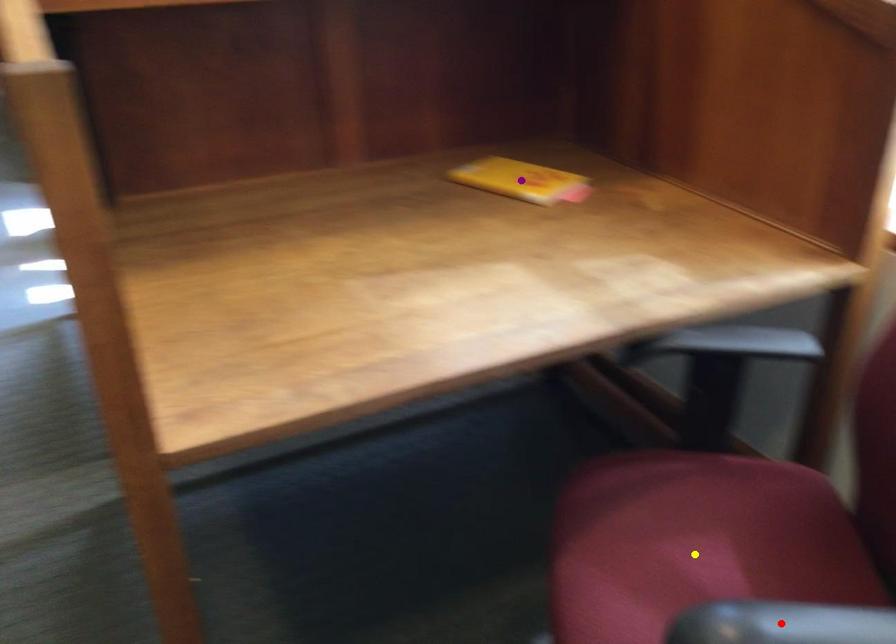
Order these from farthest to nearest:
- red point
- yellow point
- purple point

1. purple point
2. yellow point
3. red point